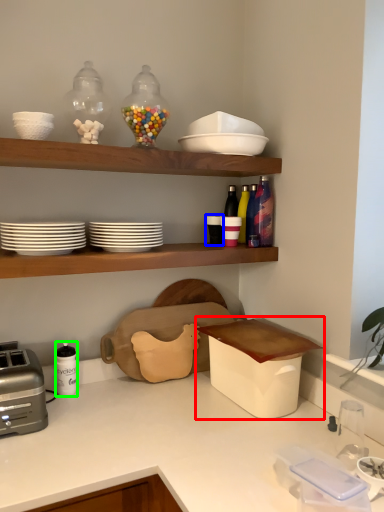
Question: Which is nearer to the appliance (highlighted by a red box)? tableware (highlighted by a blue box) or tableware (highlighted by a green box).

Choices:
 (A) tableware
 (B) tableware

Answer: (A)